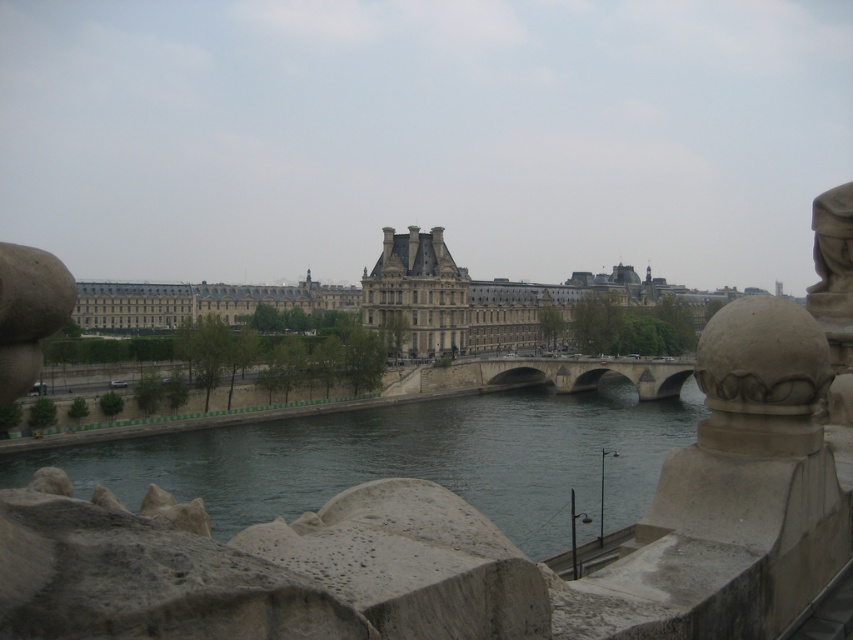
You are standing at the viewpoint overlooking the Seine River. A tourist asks you if they can walk from their current position to the point marked at coordinates point (585, 374) without crossing the river. The distance between the tourist and the point is 152.32 meters. Can they reach it on foot without crossing the river?

The point marked at coordinates point 0.588 is 152.32 meters away from the tourist. Since the distance is measurable on land, the tourist can walk to the point without crossing the river.

You are a tourist standing on the stone bridge at center, looking down at the green stone river at center. Which one do you see covering a larger area of the view below?

The green stone river at center might be wider than the stone bridge at center, so it likely covers a larger area of the view below.

Based on the photo, you are an architect evaluating the structural integrity of the scene. Given that the green stone river at center is much taller than the stone bridge at center, what potential issue might arise with the bridge during heavy rainfall?

The green stone river at center being much taller than the stone bridge at center indicates that the river could overflow and potentially flood the bridge during heavy rainfall, compromising its structural stability.